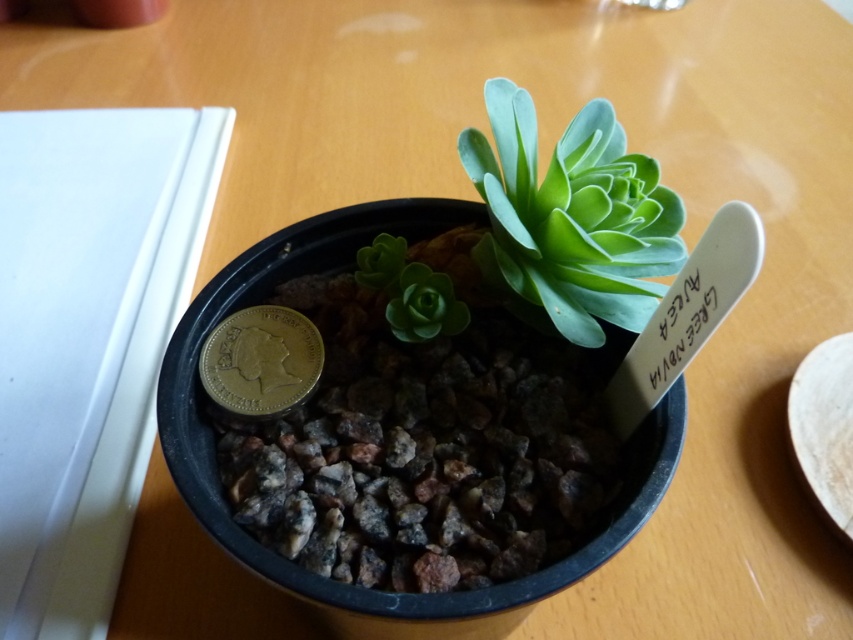
You are a gardener who wants to plant the gold plated coin at center next to the green succulent at center. Since both are at the center, which one should you move to make space?

The green succulent at center is bigger than the gold plated coin at center, so you should move the smaller gold plated coin to make space for the larger succulent.